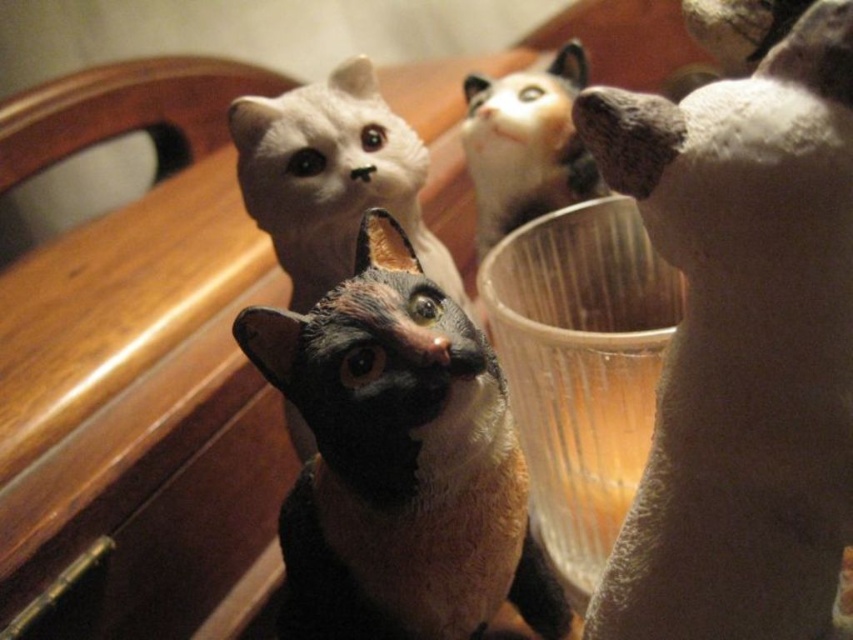
Which of these two, black glossy cat at center or white fur cat at upper right, stands shorter?

white fur cat at upper right

Between black glossy cat at center and white fur cat at upper right, which one is positioned higher?

Positioned higher is white fur cat at upper right.

This screenshot has width=853, height=640. Identify the location of black glossy cat at center. (402, 456).

Does black glossy cat at center have a larger size compared to matte white cat at upper center?

Yes, black glossy cat at center is bigger than matte white cat at upper center.

Is point (440, 404) farther from viewer compared to point (297, 182)?

No, it is in front of (297, 182).

Describe the element at coordinates (402, 456) in the screenshot. I see `black glossy cat at center` at that location.

The height and width of the screenshot is (640, 853). Find the location of `black glossy cat at center`. black glossy cat at center is located at coordinates (402, 456).

Between matte white cat at upper center and white fur cat at upper right, which one has less height?

white fur cat at upper right

Between matte white cat at upper center and white fur cat at upper right, which one appears on the left side from the viewer's perspective?

From the viewer's perspective, matte white cat at upper center appears more on the left side.

Looking at this image, who is more distant from viewer, (x=268, y=216) or (x=544, y=138)?

The point (x=544, y=138) is more distant.

Where is `matte white cat at upper center`? The width and height of the screenshot is (853, 640). matte white cat at upper center is located at coordinates (332, 177).